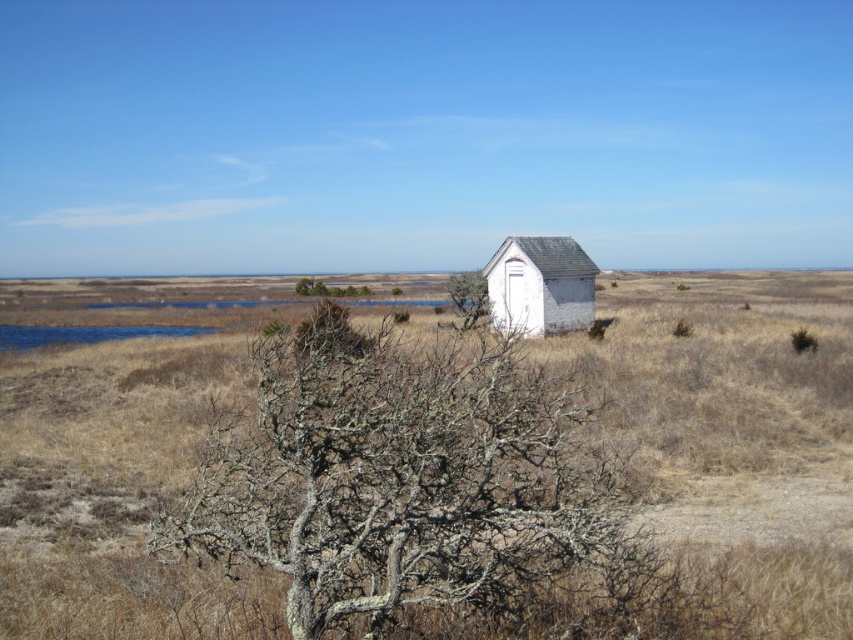
Question: Which point is farther from the camera taking this photo?

Choices:
 (A) (474, 275)
 (B) (402, 468)

Answer: (A)

Question: Can you confirm if gray lichen-covered tree at center is wider than green mossy tree at center?

Choices:
 (A) no
 (B) yes

Answer: (B)

Question: Can you confirm if white wood hut at center is thinner than green mossy tree at center?

Choices:
 (A) no
 (B) yes

Answer: (A)

Question: Based on their relative distances, which object is nearer to the green mossy tree at center?

Choices:
 (A) white wood hut at center
 (B) gray lichen-covered tree at center

Answer: (A)

Question: Which of the following is the farthest from the observer?

Choices:
 (A) gray lichen-covered tree at center
 (B) green mossy tree at center
 (C) white wood hut at center

Answer: (B)

Question: Is gray lichen-covered tree at center bigger than green mossy tree at center?

Choices:
 (A) no
 (B) yes

Answer: (A)